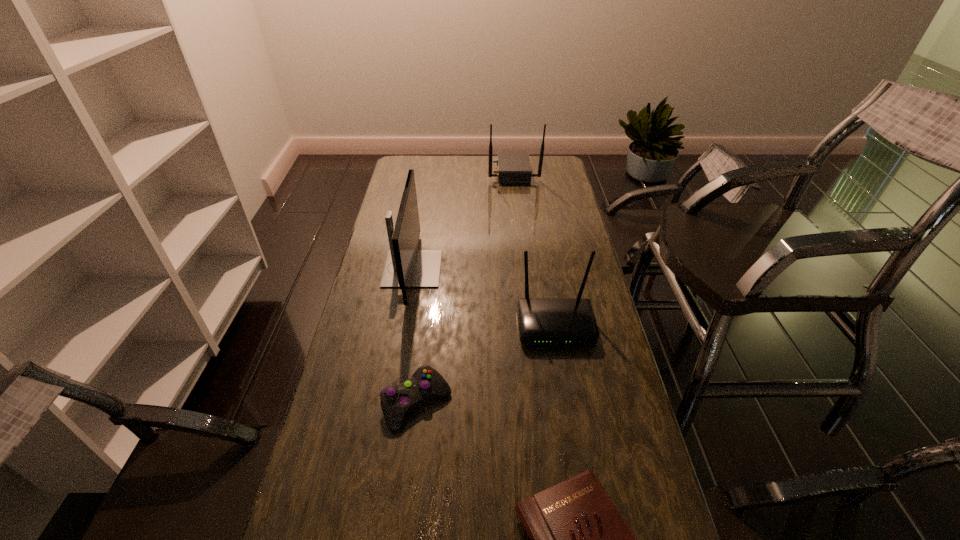
Where is `the farthest object`? The image size is (960, 540). the farthest object is located at coordinates (513, 167).

Find the location of `the taller router`. the taller router is located at coordinates (513, 167).

At what (x,y) coordinates should I click in order to perform the action: click on computer monitor. Please return your answer as a coordinate pair (x, y). Looking at the image, I should click on (405, 267).

Locate an element on the screen. This screenshot has width=960, height=540. the nearer router is located at coordinates (542, 321).

At what (x,y) coordinates should I click in order to perform the action: click on the third shortest object. Please return your answer as a coordinate pair (x, y). Looking at the image, I should click on coord(542,321).

This screenshot has height=540, width=960. I want to click on control, so click(x=396, y=400).

Locate an element on the screen. The width and height of the screenshot is (960, 540). free space located on the back of the taller router to connect cables is located at coordinates (424, 172).

Identify the location of free space located on the back of the taller router to connect cables. (432, 172).

Where is `vacant area situated 0.240m on the back of the taller router to connect cables`? vacant area situated 0.240m on the back of the taller router to connect cables is located at coordinates (439, 172).

Find the location of a particular element. Image resolution: width=960 pixels, height=540 pixels. vacant area situated 0.090m on the screen of the computer monitor is located at coordinates (465, 269).